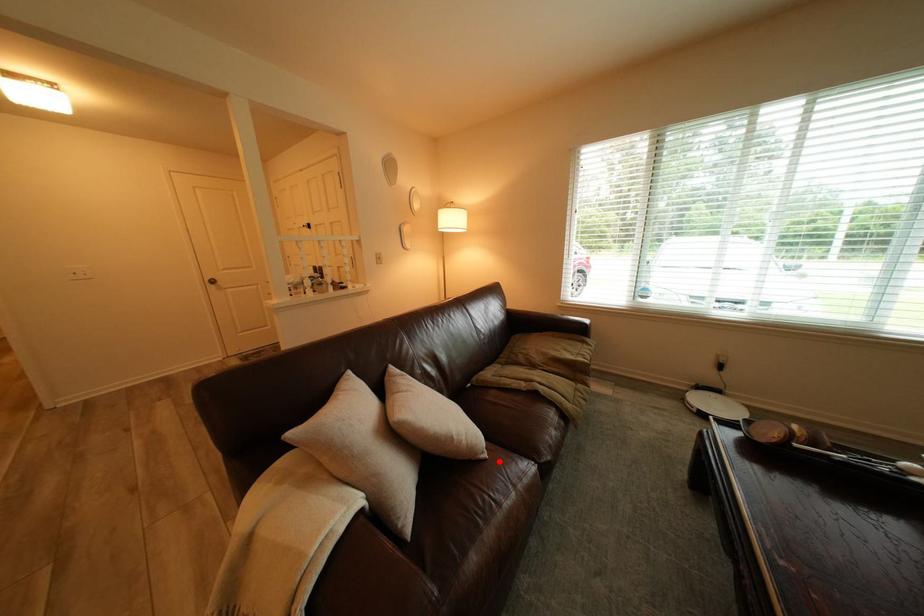
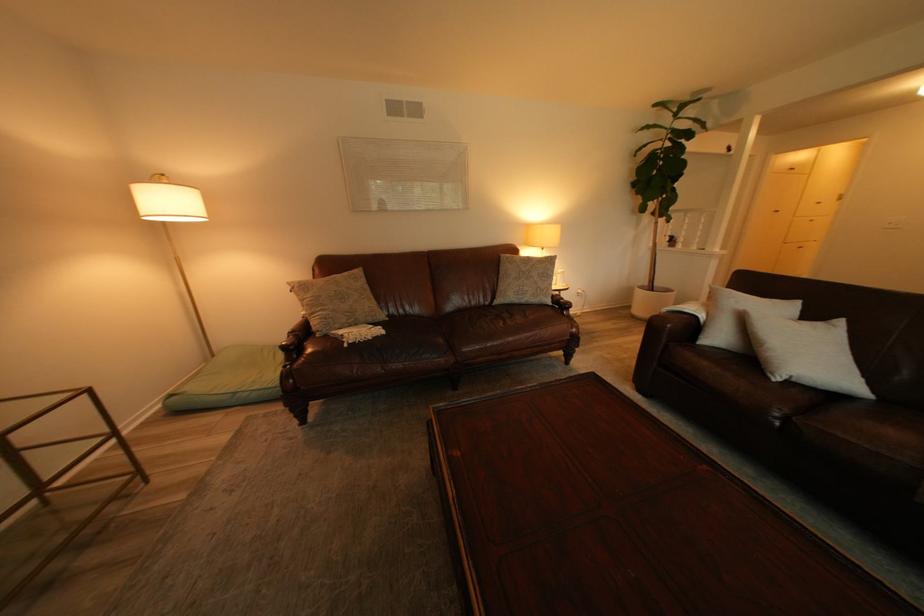
Question: I am providing you with two images of the same scene from different viewpoints. A red point is shown in image1. For the corresponding object point in image2, is it positioned nearer or farther from the camera?

Choices:
 (A) Nearer
 (B) Farther

Answer: (A)